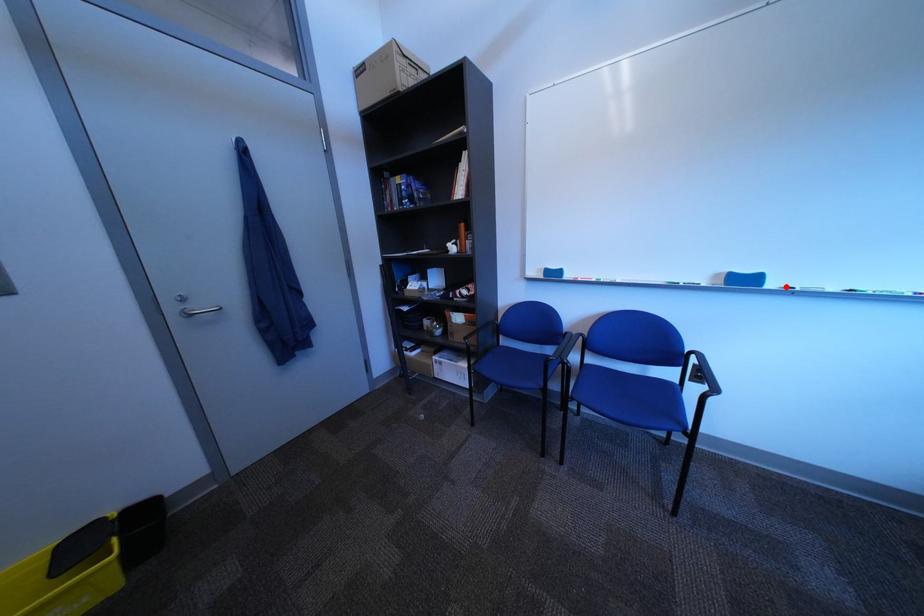
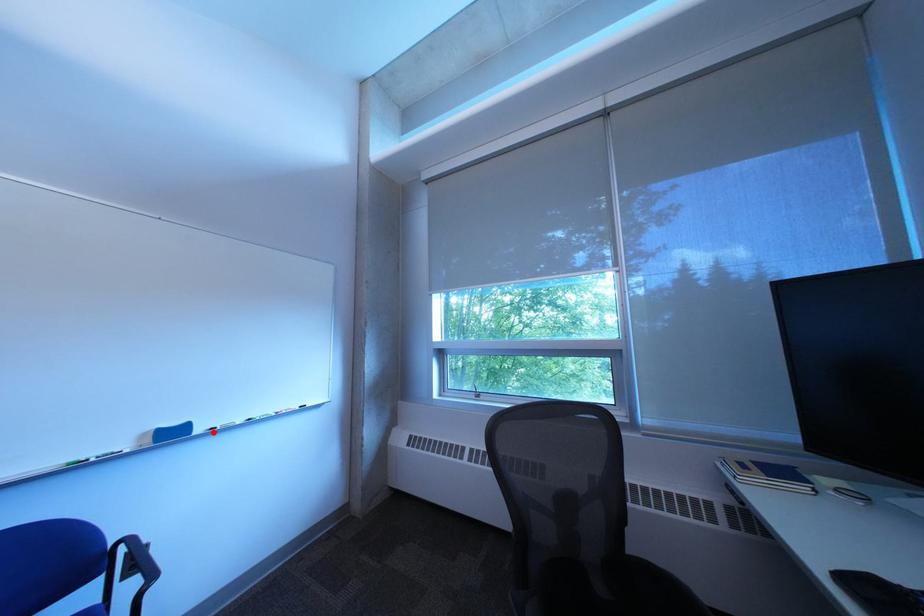
I am providing you with two images of the same scene from different viewpoints. A red point is marked on the first image and another point is marked on the second image. Does the point marked in image1 correspond to the same location as the one in image2?

Yes